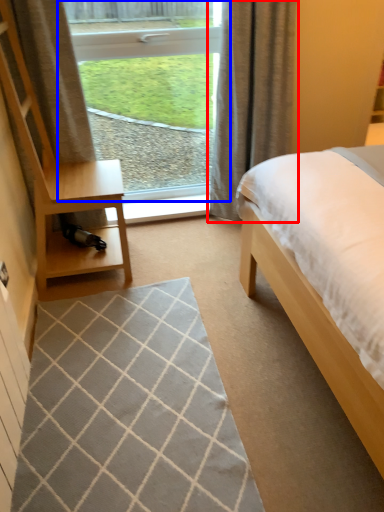
Question: Which object is further to the camera taking this photo, curtain (highlighted by a red box) or window (highlighted by a blue box)?

Choices:
 (A) curtain
 (B) window

Answer: (B)